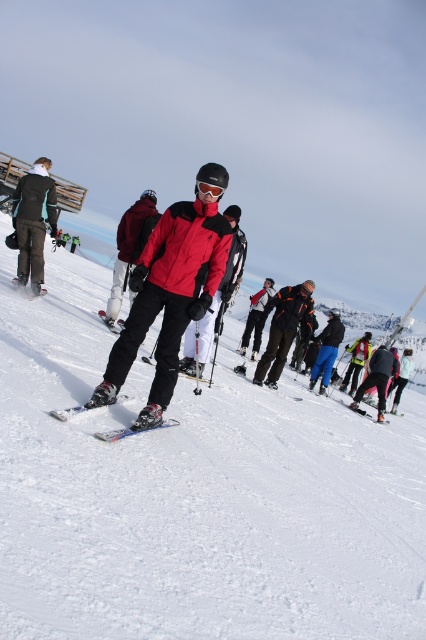
Question: Which point is farther to the camera?

Choices:
 (A) white powdery snow at center
 (B) matte black jacket at left
 (C) matte black goggles at center
 (D) metallic blue skis at center

Answer: (B)

Question: Is matte black jacket at left further to camera compared to matte black ski at lower left?

Choices:
 (A) no
 (B) yes

Answer: (A)

Question: Estimate the real-world distances between objects in this image. Which object is closer to the matte black ski at lower left?

Choices:
 (A) matte black jacket at left
 (B) matte black goggles at center
 (C) metallic blue skis at center
 (D) matte red jacket at center

Answer: (A)

Question: Can you confirm if matte black jacket at left is positioned above matte black ski at lower left?

Choices:
 (A) no
 (B) yes

Answer: (B)

Question: Which object is positioned closest to the metallic blue skis at center?

Choices:
 (A) white powdery snow at center
 (B) matte black jacket at left
 (C) matte black goggles at center
 (D) matte black ski at lower left

Answer: (C)

Question: Can you confirm if metallic blue skis at center is positioned to the right of matte black goggles at center?

Choices:
 (A) no
 (B) yes

Answer: (A)